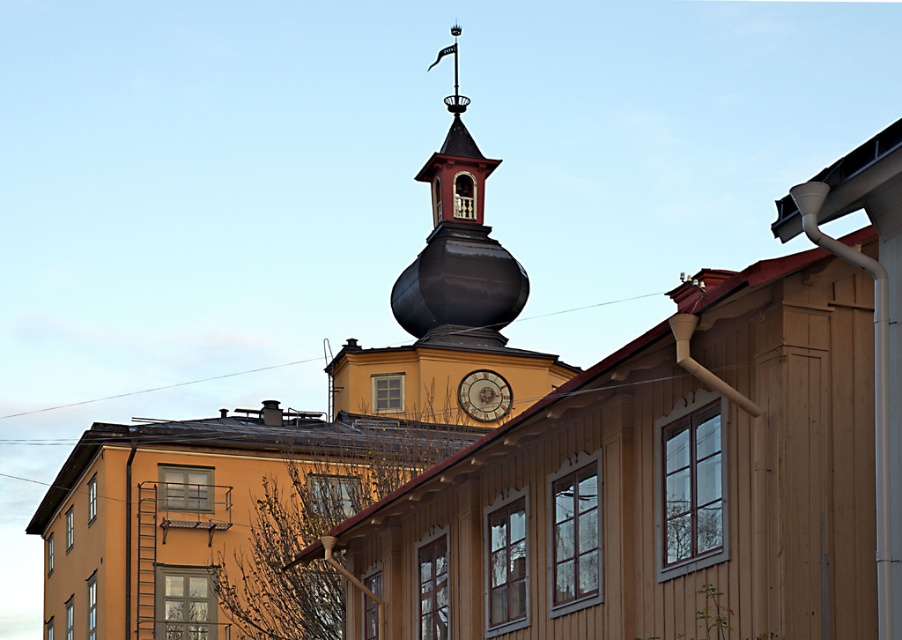
Can you confirm if black glossy clock tower at upper center is positioned above gold metallic clock at center?

Indeed, black glossy clock tower at upper center is positioned over gold metallic clock at center.

Which is more to the left, black glossy clock tower at upper center or gold metallic clock at center?

From the viewer's perspective, black glossy clock tower at upper center appears more on the left side.

Which is in front, point (440, 419) or point (476, 410)?

Point (440, 419) is in front.

The height and width of the screenshot is (640, 902). Identify the location of black glossy clock tower at upper center. (447, 301).

Between point (490, 268) and point (476, 385), which one is positioned behind?

Point (490, 268)

Who is more forward, (457,83) or (465,392)?

Positioned in front is point (465,392).

What do you see at coordinates (458, 246) in the screenshot? The image size is (902, 640). I see `shiny dark brown bell tower at upper center` at bounding box center [458, 246].

Locate an element on the screen. The width and height of the screenshot is (902, 640). shiny dark brown bell tower at upper center is located at coordinates (458, 246).

Consider the image. Can you confirm if black glossy clock tower at upper center is positioned below shiny dark brown bell tower at upper center?

Indeed, black glossy clock tower at upper center is positioned under shiny dark brown bell tower at upper center.

Is black glossy clock tower at upper center to the left of shiny dark brown bell tower at upper center from the viewer's perspective?

No, black glossy clock tower at upper center is not to the left of shiny dark brown bell tower at upper center.

The width and height of the screenshot is (902, 640). What do you see at coordinates (447, 301) in the screenshot?
I see `black glossy clock tower at upper center` at bounding box center [447, 301].

Locate an element on the screen. The image size is (902, 640). black glossy clock tower at upper center is located at coordinates [447, 301].